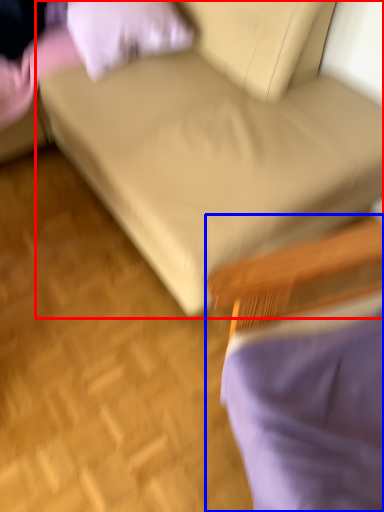
Question: Which of the following is the farthest to the observer, studio couch (highlighted by a red box) or chair (highlighted by a blue box)?

Choices:
 (A) studio couch
 (B) chair

Answer: (A)